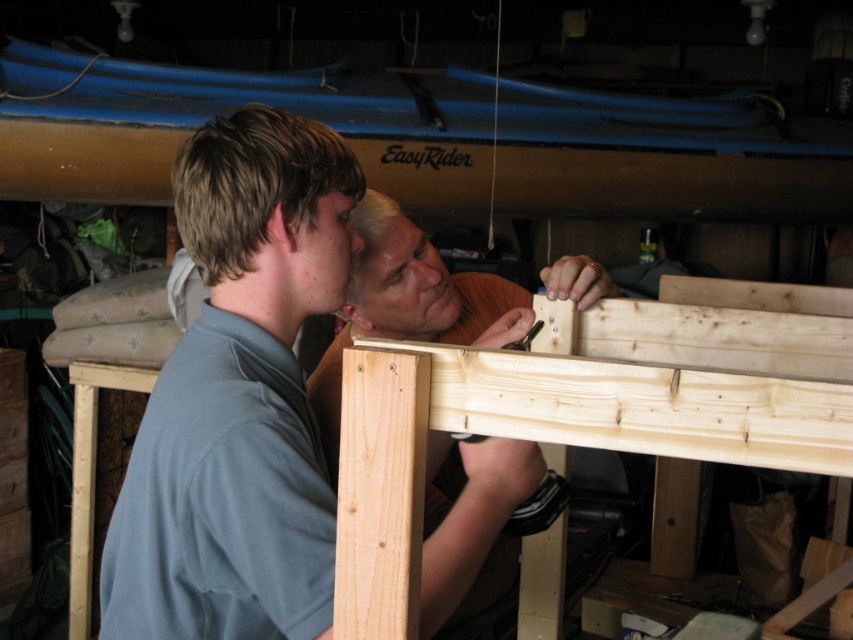
Is light blue shirt at center smaller than natural wood plank at center?

Indeed, light blue shirt at center has a smaller size compared to natural wood plank at center.

Between point (161, 561) and point (585, 269), which one is positioned behind?

The point (585, 269) is behind.

This screenshot has height=640, width=853. I want to click on light blue shirt at center, so click(238, 397).